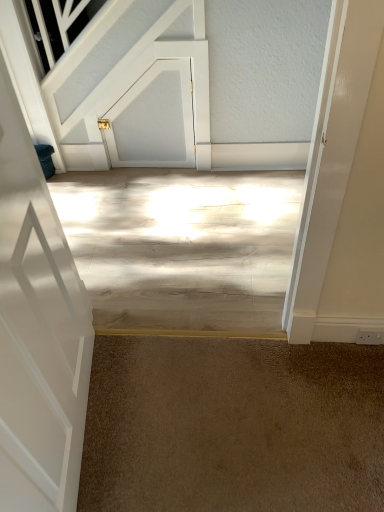
You are a GUI agent. You are given a task and a screenshot of the screen. Output one action in this format:
    pyautogui.click(x=<x>, y=<y>)
    Task: Click on the vacant region under white glossy door at left, acting as the 1th door starting from the bottom (from a real-world perspective)
    
    Given the screenshot: What is the action you would take?
    pyautogui.click(x=86, y=424)